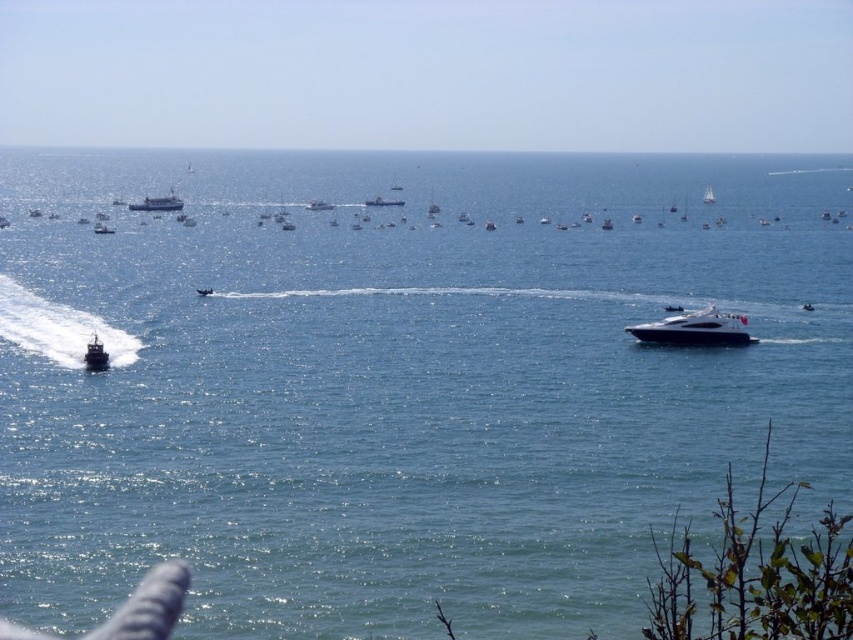
You are a photographer trying to capture the white matte ship at upper center and the shiny black motorboat at left in the same frame. Considering their sizes, which one would appear larger in your photo?

The white matte ship at upper center is much taller than the shiny black motorboat at left, so it would appear larger in the photo.